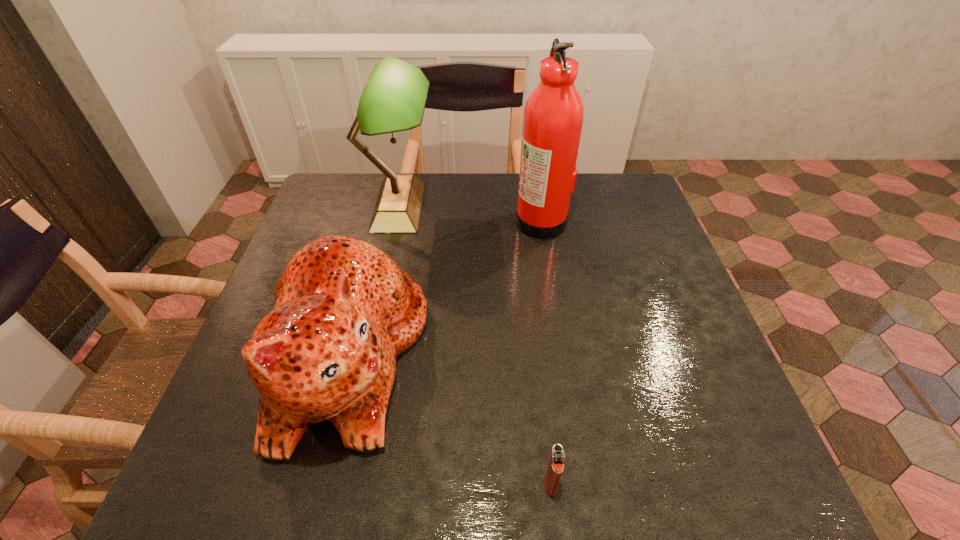
Locate an element on the screen. free space between the tallest object and the igniter is located at coordinates (546, 352).

Where is `object that is the closest to the shortest object`? The width and height of the screenshot is (960, 540). object that is the closest to the shortest object is located at coordinates (344, 311).

Identify the location of object that can be found as the closest to the second shortest object. The image size is (960, 540). (394, 98).

Identify the location of free space that satisfies the following two spatial constraints: 1. on the face of the third tallest object; 2. on the left side of the nearest object. (316, 484).

Identify the location of free spot that satisfies the following two spatial constraints: 1. on the face of the second nearest object; 2. on the left side of the shortest object. coord(316,484).

This screenshot has width=960, height=540. I want to click on free spot that satisfies the following two spatial constraints: 1. on the face of the third farthest object; 2. on the right side of the shortest object, so click(316, 484).

Locate an element on the screen. The width and height of the screenshot is (960, 540). vacant space that satisfies the following two spatial constraints: 1. on the face of the nearest object; 2. on the left side of the cat is located at coordinates (316, 484).

I want to click on free spot that satisfies the following two spatial constraints: 1. on the face of the cat; 2. on the right side of the igniter, so click(x=316, y=484).

Identify the location of vacant space that satisfies the following two spatial constraints: 1. on the metallic stand of the nearest object; 2. on the right side of the second tallest object. The image size is (960, 540). (337, 484).

Identify the location of free point that satisfies the following two spatial constraints: 1. on the face of the nearest object; 2. on the left side of the second shortest object. click(316, 484).